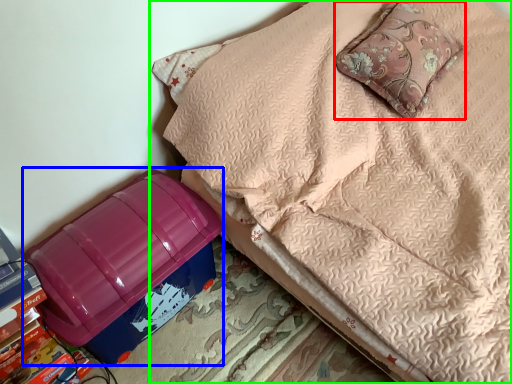
Question: Which object is positioned closest to pillow (highlighted by a red box)? Select from storage box (highlighted by a blue box) and furniture (highlighted by a green box).

Choices:
 (A) storage box
 (B) furniture

Answer: (B)